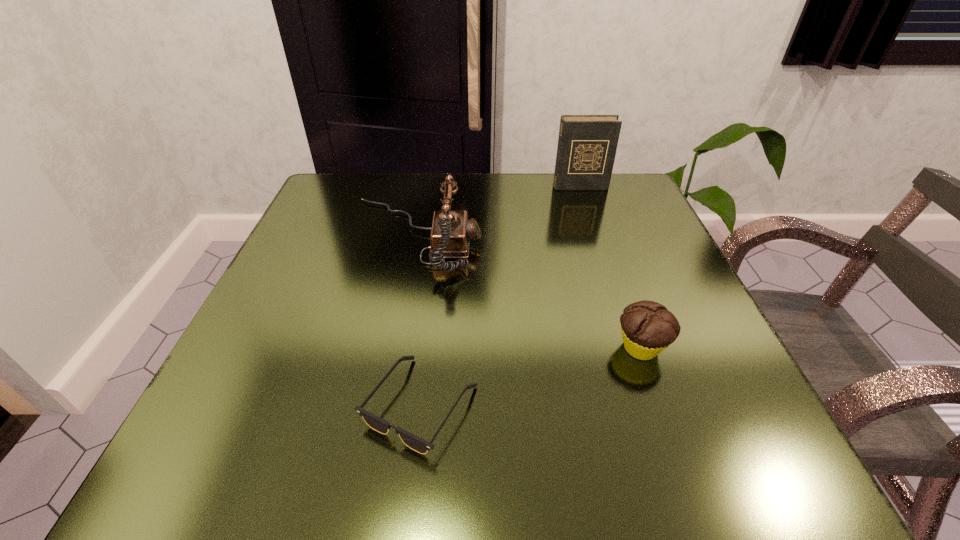
Locate an element on the screen. This screenshot has height=540, width=960. free space at the right edge is located at coordinates (680, 367).

Locate an element on the screen. Image resolution: width=960 pixels, height=540 pixels. vacant space at the far left corner is located at coordinates (329, 211).

Locate an element on the screen. free point at the far right corner is located at coordinates (578, 210).

The width and height of the screenshot is (960, 540). Identify the location of free space between the diary and the sunglasses. (500, 296).

You are a GUI agent. You are given a task and a screenshot of the screen. Output one action in this format:
    pyautogui.click(x=<x>, y=<y>)
    Task: Click on the free space between the diary and the telephone
    The width and height of the screenshot is (960, 540).
    Given the screenshot: What is the action you would take?
    pyautogui.click(x=497, y=212)

The image size is (960, 540). What are the coordinates of `vacant space that's between the tallest object and the second tallest object` in the screenshot? It's located at (497, 212).

The image size is (960, 540). Find the location of `free space between the third tallest object and the shortest object`. free space between the third tallest object and the shortest object is located at coordinates (531, 376).

You are a GUI agent. You are given a task and a screenshot of the screen. Output one action in this format:
    pyautogui.click(x=<x>, y=<y>)
    Task: Click on the unoccupied position between the shortest object and the telephone
    
    Given the screenshot: What is the action you would take?
    pyautogui.click(x=418, y=321)

The image size is (960, 540). Identify the location of vacant area between the second tallest object and the second shortest object. (528, 292).

What are the coordinates of `vacant area between the shortest object and the muffin` in the screenshot? It's located at (531, 376).